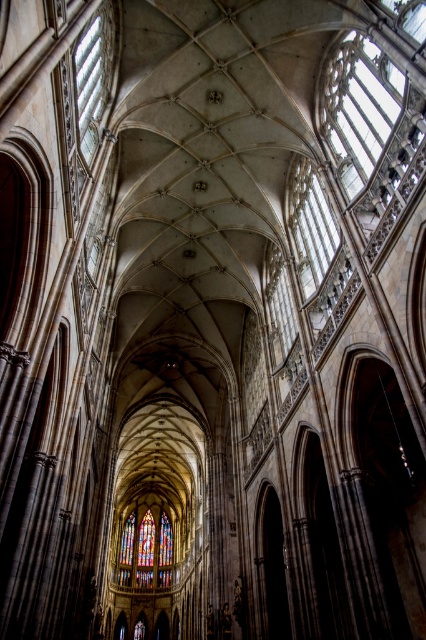
Is point (339, 241) closer to camera compared to point (143, 570)?

That is True.

At what (x,y) coordinates should I click in order to perform the action: click on clear glass window at upper right. Please return your answer as a coordinate pair (x, y). Looking at the image, I should click on (310, 227).

Is clear glass at upper right bigger than clear glass window at upper left?

Yes.

Who is taller, clear glass at upper right or clear glass window at upper left?

Standing taller between the two is clear glass at upper right.

The height and width of the screenshot is (640, 426). Describe the element at coordinates (359, 108) in the screenshot. I see `clear glass at upper right` at that location.

You are a GUI agent. You are given a task and a screenshot of the screen. Output one action in this format:
    pyautogui.click(x=<x>, y=<y>)
    Task: Click on the clear glass at upper right
    Image resolution: width=426 pixels, height=640 pixels.
    Given the screenshot: What is the action you would take?
    pyautogui.click(x=359, y=108)

What do you see at coordinates (359, 108) in the screenshot?
I see `clear glass at upper right` at bounding box center [359, 108].

Does clear glass at upper right have a smaller size compared to stained glass at center?

Yes.

Between point (374, 96) and point (152, 520), which one is positioned in front?

Positioned in front is point (374, 96).

Where is `clear glass at upper right`? Image resolution: width=426 pixels, height=640 pixels. clear glass at upper right is located at coordinates [x=359, y=108].